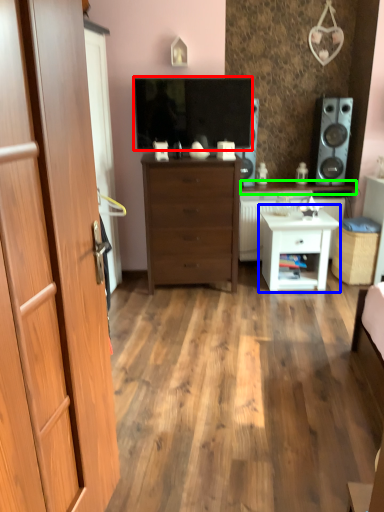
Question: Based on their relative distances, which object is nearer to television (highlighted by a red box)? Choose from nightstand (highlighted by a blue box) and counter top (highlighted by a green box).

Choices:
 (A) nightstand
 (B) counter top

Answer: (A)